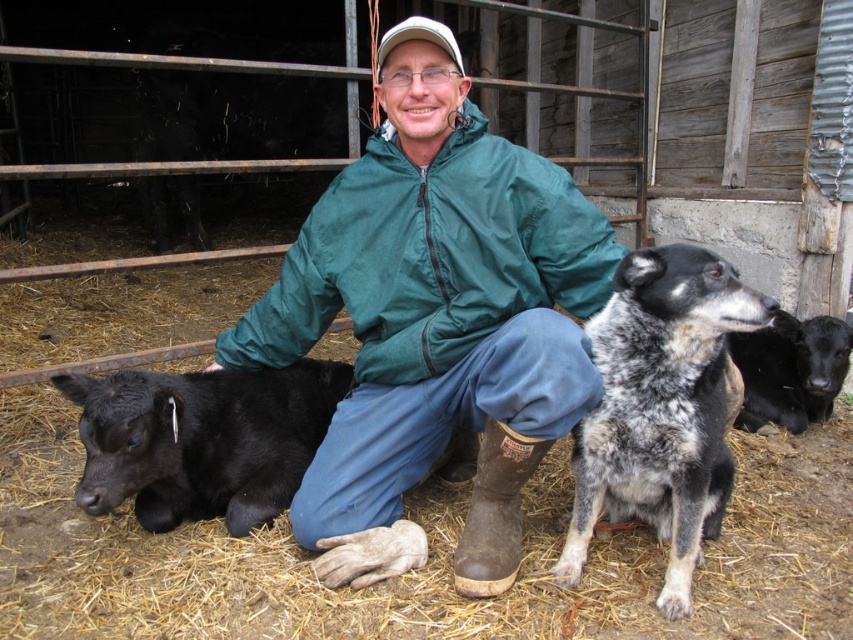
Question: Where is green fabric jacket at center located in relation to black fur calf at lower left in the image?

Choices:
 (A) below
 (B) above

Answer: (B)

Question: Is black smooth calf at lower left behind brown leather boot at lower center?

Choices:
 (A) yes
 (B) no

Answer: (A)

Question: Estimate the real-world distances between objects in this image. Which object is farther from the black fur calf at lower left?

Choices:
 (A) green fabric jacket at center
 (B) brown leather boot at lower center
 (C) spotted fur dog at center

Answer: (B)

Question: Considering the real-world distances, which object is farthest from the green fabric jacket at center?

Choices:
 (A) spotted fur dog at center
 (B) black fur calf at lower left

Answer: (B)

Question: Which object is positioned closest to the black fur calf at lower left?

Choices:
 (A) brown leather boot at lower center
 (B) spotted fur dog at center
 (C) black smooth calf at lower left

Answer: (B)

Question: Is green fabric jacket at center bigger than spotted fur dog at center?

Choices:
 (A) no
 (B) yes

Answer: (B)